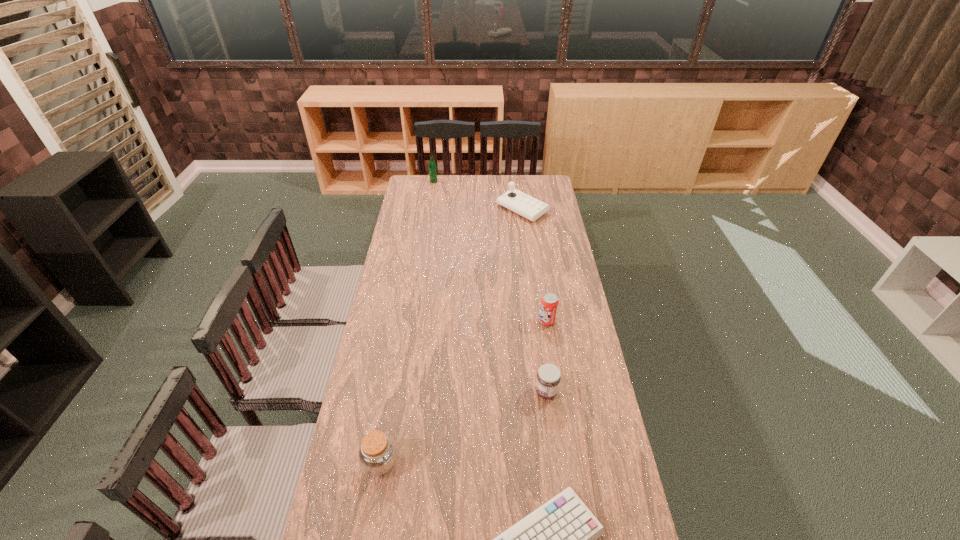
The image size is (960, 540). What are the coordinates of `bottle` in the screenshot? It's located at click(x=432, y=167).

Find the location of `joystick`. joystick is located at coordinates (527, 206).

Where is `the fourth nearest object`? The image size is (960, 540). the fourth nearest object is located at coordinates (549, 302).

Locate an element on the screen. This screenshot has height=540, width=960. the second nearest object is located at coordinates (377, 454).

Where is `jam`? The height and width of the screenshot is (540, 960). jam is located at coordinates (548, 379).

Find the location of `vacant space located on the front of the farthest object`. vacant space located on the front of the farthest object is located at coordinates (428, 214).

In order to click on vacant region located 0.170m on the back of the joystick in this screenshot , I will do `click(518, 181)`.

Where is `free space located on the surface of the fourth nearest object`? Image resolution: width=960 pixels, height=540 pixels. free space located on the surface of the fourth nearest object is located at coordinates (521, 321).

The image size is (960, 540). Find the location of `free spot located on the surface of the fourth nearest object`. free spot located on the surface of the fourth nearest object is located at coordinates (494, 321).

The width and height of the screenshot is (960, 540). Find the location of `free space located 0.310m on the surface of the fourth nearest object`. free space located 0.310m on the surface of the fourth nearest object is located at coordinates (463, 321).